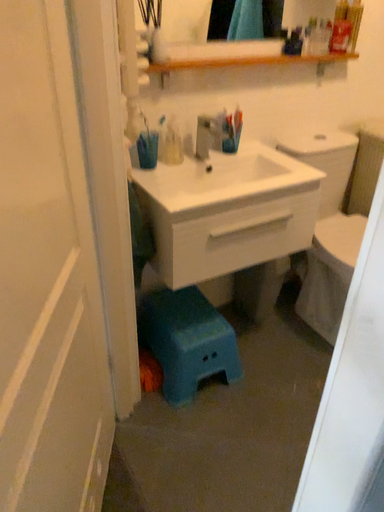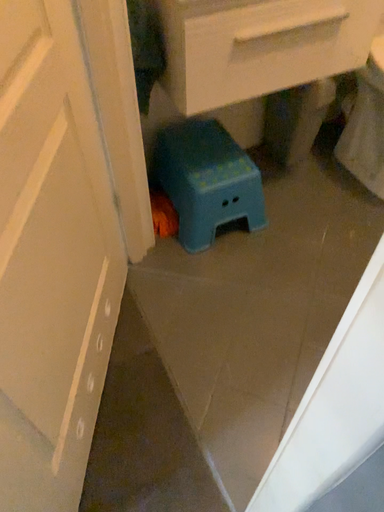
Question: Which way did the camera rotate in the video?

Choices:
 (A) rotated upward
 (B) rotated downward

Answer: (B)